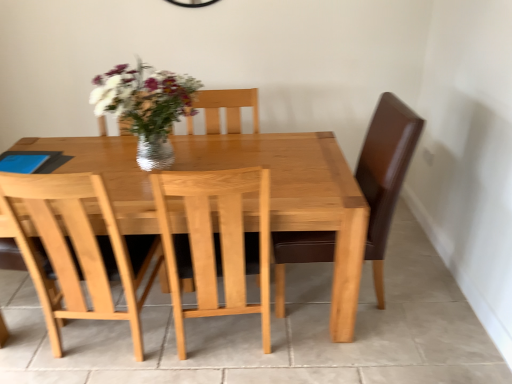
Find the location of a particular element. Image resolution: width=512 pixels, height=384 pixels. empty space that is ontop of light brown wooden table at center (from a real-world perspective) is located at coordinates (177, 165).